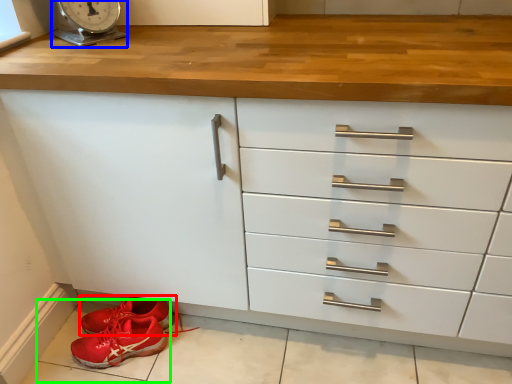
Question: Based on their relative distances, which object is nearer to footwear (highlighted by a red box)? Choose from scale (highlighted by a blue box) and tile (highlighted by a green box).

Choices:
 (A) scale
 (B) tile

Answer: (B)